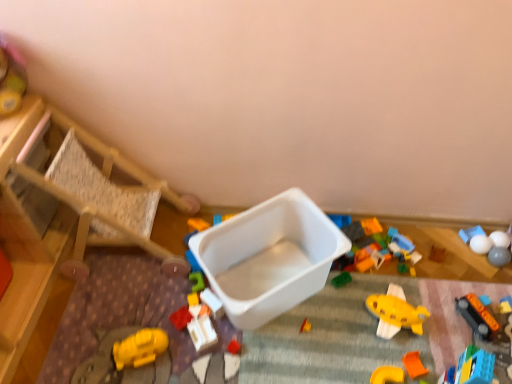
Where is `free area in between rubberized plastic toy at center, the thirteenth toy positioned from the right, and yellow matte airplane at center, placed as the eighth toy when sorted from right to left`? The width and height of the screenshot is (512, 384). free area in between rubberized plastic toy at center, the thirteenth toy positioned from the right, and yellow matte airplane at center, placed as the eighth toy when sorted from right to left is located at coordinates tap(321, 326).